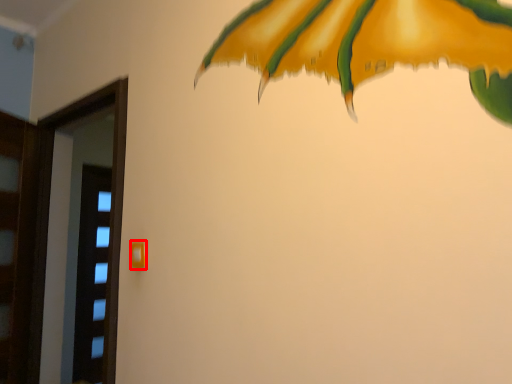
Question: Considering the relative positions of door handle (annotated by the red box) and screen door in the image provided, where is door handle (annotated by the red box) located with respect to the staircase?

Choices:
 (A) left
 (B) right

Answer: (B)